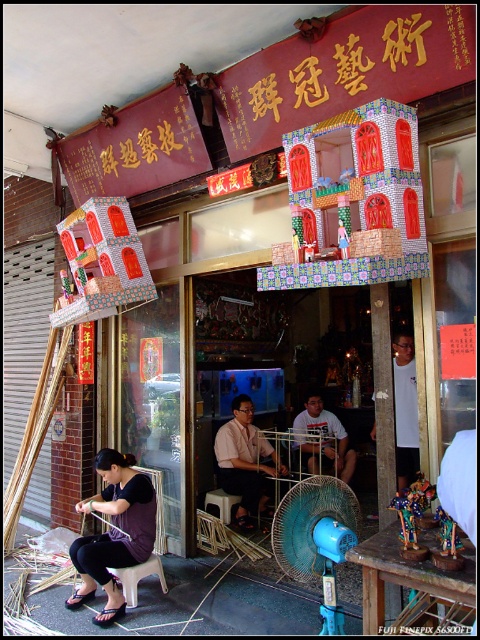
Question: Is matte purple dress at lower left smaller than goldmetalsignboard at upper center?

Choices:
 (A) yes
 (B) no

Answer: (B)

Question: In this image, where is blue plastic mechanical fan at lower center located relative to white cotton shirt at center?

Choices:
 (A) left
 (B) right

Answer: (A)

Question: Estimate the real-world distances between objects in this image. Which object is farther from the goldmetalsignboard at upper center?

Choices:
 (A) light brown shirt at center
 (B) white cotton shirt at center
 (C) blue plastic mechanical fan at lower center
 (D) matte purple dress at lower left

Answer: (B)

Question: Among these objects, which one is farthest from the camera?

Choices:
 (A) blue plastic mechanical fan at lower center
 (B) white cotton shirt at center
 (C) light brown shirt at center

Answer: (B)

Question: Is matte purple dress at lower left bigger than goldmetalsignboard at upper center?

Choices:
 (A) yes
 (B) no

Answer: (A)

Question: Which object appears closest to the camera in this image?

Choices:
 (A) blue plastic mechanical fan at lower center
 (B) goldmetalsignboard at upper center

Answer: (B)